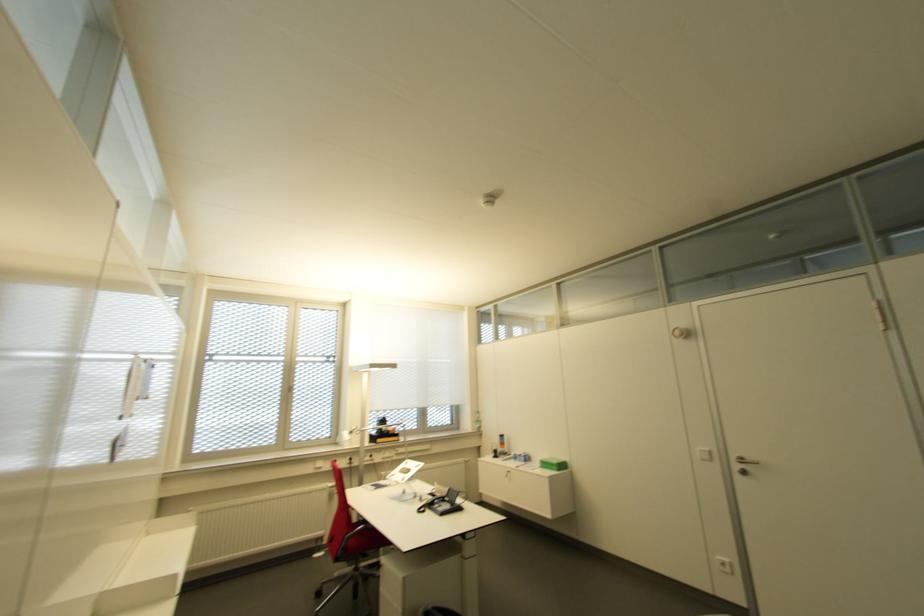
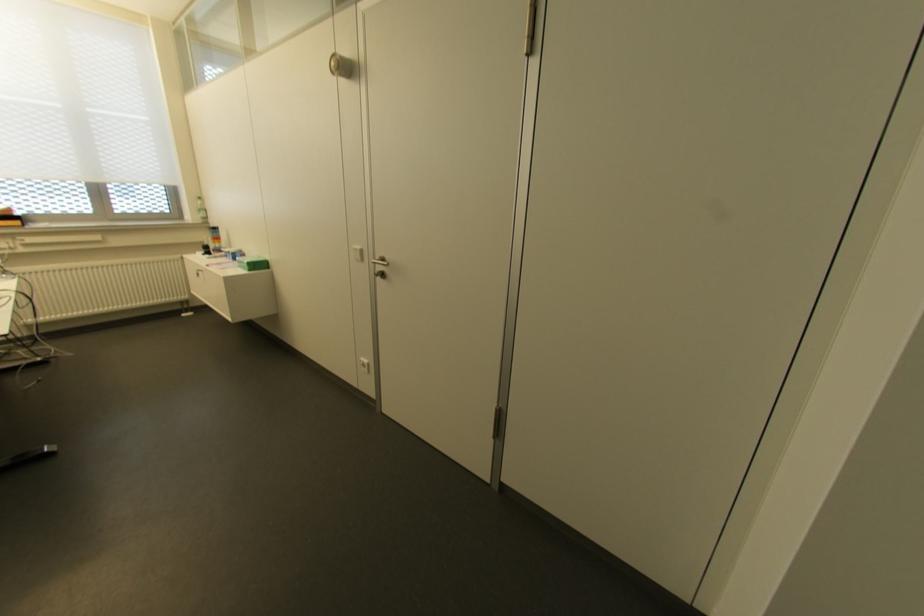
Locate, in the second image, the point that corresponds to (478,428) in the first image.

(204, 217)